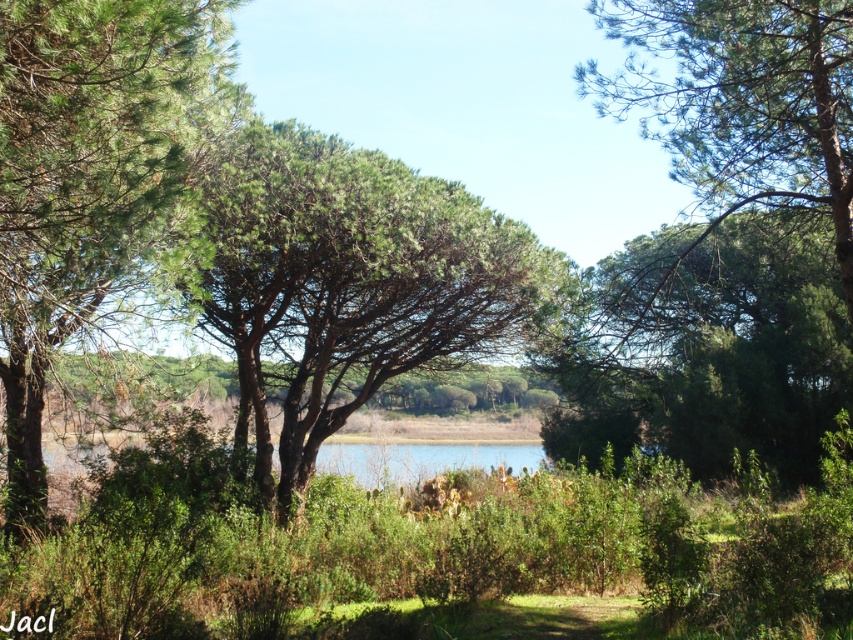
Between green needle-like at left and green matte tree at center, which one appears on the left side from the viewer's perspective?

From the viewer's perspective, green needle-like at left appears more on the left side.

Find the location of a particular element. The height and width of the screenshot is (640, 853). green needle-like at left is located at coordinates (90, 179).

You are a GUI agent. You are given a task and a screenshot of the screen. Output one action in this format:
    pyautogui.click(x=<x>, y=<y>)
    Task: Click on the green needle-like at left
    This screenshot has width=853, height=640.
    Given the screenshot: What is the action you would take?
    pyautogui.click(x=90, y=179)

Between point (297, 280) and point (158, 234), which one is positioned behind?

The point (297, 280) is more distant.

Who is more forward, (252, 124) or (25, 198)?

Point (25, 198) is more forward.

Who is more forward, (523, 328) or (51, 160)?

Point (51, 160)

Where is `green leafy tree at center`? Image resolution: width=853 pixels, height=640 pixels. green leafy tree at center is located at coordinates (344, 280).

Does green leafy tree at center lie in front of green matte tree at center?

No.

What do you see at coordinates (344, 280) in the screenshot? I see `green leafy tree at center` at bounding box center [344, 280].

This screenshot has width=853, height=640. In order to click on green leafy tree at center in this screenshot , I will do `click(344, 280)`.